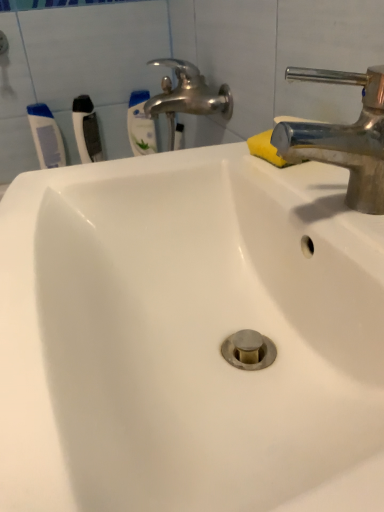
You are a GUI agent. You are given a task and a screenshot of the screen. Output one action in this format:
    pyautogui.click(x=<x>, y=<y>)
    Task: Click on the white plastic toothbrush at upper left, the second toothbrush from the left
    The height and width of the screenshot is (512, 384).
    Given the screenshot: What is the action you would take?
    (x=86, y=130)

Locate an element on the screen. polished chrome tap at upper right is located at coordinates (343, 137).

What are the coordinates of `white plastic toothbrush at upper left, acting as the second toothbrush starting from the right` in the screenshot? It's located at (86, 130).

Can you confirm if white plastic toothbrush at upper left, acting as the second toothbrush starting from the right, is positioned to the right of yellow sponge at upper right?

No, white plastic toothbrush at upper left, acting as the second toothbrush starting from the right, is not to the right of yellow sponge at upper right.

Image resolution: width=384 pixels, height=512 pixels. Find the location of `toothbrush that is the 2nd object located above the yellow sponge at upper right (from the image's perspective)`. toothbrush that is the 2nd object located above the yellow sponge at upper right (from the image's perspective) is located at coordinates (86, 130).

From the image's perspective, which one is positioned lower, white plastic toothbrush at upper left, acting as the second toothbrush starting from the right, or yellow sponge at upper right?

yellow sponge at upper right appears lower in the image.

Do you think yellow sponge at upper right is within white plastic toothbrush at upper left, the second toothbrush from the left, or outside of it?

yellow sponge at upper right is not enclosed by white plastic toothbrush at upper left, the second toothbrush from the left.

Is yellow sponge at upper right oriented towards white plastic toothbrush at upper left, acting as the second toothbrush starting from the right?

No, yellow sponge at upper right does not turn towards white plastic toothbrush at upper left, acting as the second toothbrush starting from the right.

Is there a large distance between yellow sponge at upper right and white plastic toothbrush at upper left, acting as the second toothbrush starting from the right?

No, yellow sponge at upper right is in close proximity to white plastic toothbrush at upper left, acting as the second toothbrush starting from the right.

Considering the relative sizes of yellow sponge at upper right and white plastic toothbrush at upper left, acting as the second toothbrush starting from the right, in the image provided, is yellow sponge at upper right taller than white plastic toothbrush at upper left, acting as the second toothbrush starting from the right,?

In fact, yellow sponge at upper right may be shorter than white plastic toothbrush at upper left, acting as the second toothbrush starting from the right.

From the image's perspective, is white plastic toothbrush at upper left, which is the third toothbrush from left to right, below polished chrome tap at upper right?

Incorrect, from the image's perspective, white plastic toothbrush at upper left, which is the third toothbrush from left to right, is higher than polished chrome tap at upper right.

Is white plastic toothbrush at upper left, which is the third toothbrush from left to right, turned away from polished chrome tap at upper right?

That's not correct — white plastic toothbrush at upper left, which is the third toothbrush from left to right, is not looking away from polished chrome tap at upper right.

Does white plastic toothbrush at upper left, which is the third toothbrush from left to right, have a lesser width compared to polished chrome tap at upper right?

Correct, the width of white plastic toothbrush at upper left, which is the third toothbrush from left to right, is less than that of polished chrome tap at upper right.

Does white plastic toothbrush at upper left, which ranks as the 1th toothbrush in right-to-left order, appear on the left side of polished chrome tap at upper right?

Yes, white plastic toothbrush at upper left, which ranks as the 1th toothbrush in right-to-left order, is to the left of polished chrome tap at upper right.

Does point (58, 146) appear closer or farther from the camera than point (284, 148)?

Point (58, 146).

This screenshot has height=512, width=384. I want to click on tap located below the white plastic toothbrush at upper left, acting as the first toothbrush starting from the left (from the image's perspective), so click(343, 137).

Is white plastic toothbrush at upper left, which is the third toothbrush in right-to-left order, taller or shorter than polished chrome tap at upper right?

In the image, white plastic toothbrush at upper left, which is the third toothbrush in right-to-left order, appears to be taller than polished chrome tap at upper right.

From the image's perspective, which one is positioned higher, yellow sponge at upper right or white plastic toothbrush at upper left, which ranks as the 1th toothbrush in right-to-left order?

From the image's view, white plastic toothbrush at upper left, which ranks as the 1th toothbrush in right-to-left order, is above.

Considering the relative sizes of yellow sponge at upper right and white plastic toothbrush at upper left, which is the third toothbrush from left to right, in the image provided, is yellow sponge at upper right smaller than white plastic toothbrush at upper left, which is the third toothbrush from left to right,?

Indeed, yellow sponge at upper right has a smaller size compared to white plastic toothbrush at upper left, which is the third toothbrush from left to right.

Is yellow sponge at upper right positioned beyond the bounds of white plastic toothbrush at upper left, which is the third toothbrush from left to right?

Indeed, yellow sponge at upper right is completely outside white plastic toothbrush at upper left, which is the third toothbrush from left to right.

From a real-world perspective, does polished chrome tap at upper right stand above white plastic toothbrush at upper left, which ranks as the 1th toothbrush in right-to-left order?

Yes, from a real-world perspective, polished chrome tap at upper right is over white plastic toothbrush at upper left, which ranks as the 1th toothbrush in right-to-left order

Based on their positions, is polished chrome tap at upper right located to the left or right of white plastic toothbrush at upper left, which is the third toothbrush from left to right?

Clearly, polished chrome tap at upper right is on the right of white plastic toothbrush at upper left, which is the third toothbrush from left to right, in the image.

The width and height of the screenshot is (384, 512). In the image, there is a white plastic toothbrush at upper left, which ranks as the 1th toothbrush in right-to-left order. Identify the location of tap below it (from the image's perspective). (343, 137).

Would you say white plastic toothbrush at upper left, which is the third toothbrush in right-to-left order, is inside or outside white plastic toothbrush at upper left, acting as the second toothbrush starting from the right?

white plastic toothbrush at upper left, which is the third toothbrush in right-to-left order, is not inside white plastic toothbrush at upper left, acting as the second toothbrush starting from the right, it's outside.

Is white plastic toothbrush at upper left, acting as the first toothbrush starting from the left, facing away from white plastic toothbrush at upper left, the second toothbrush from the left?

No, white plastic toothbrush at upper left, acting as the first toothbrush starting from the left, is not facing away from white plastic toothbrush at upper left, the second toothbrush from the left.

Could you measure the distance between white plastic toothbrush at upper left, acting as the first toothbrush starting from the left, and white plastic toothbrush at upper left, acting as the second toothbrush starting from the right?

white plastic toothbrush at upper left, acting as the first toothbrush starting from the left, and white plastic toothbrush at upper left, acting as the second toothbrush starting from the right, are 3.73 inches apart from each other.

Is white plastic toothbrush at upper left, which is the third toothbrush in right-to-left order, taller or shorter than white plastic toothbrush at upper left, the second toothbrush from the left?

white plastic toothbrush at upper left, which is the third toothbrush in right-to-left order, is shorter than white plastic toothbrush at upper left, the second toothbrush from the left.

At what (x,y) coordinates should I click in order to perform the action: click on soap lying below the white plastic toothbrush at upper left, the second toothbrush from the left (from the image's perspective). Please return your answer as a coordinate pair (x, y). The image size is (384, 512). Looking at the image, I should click on (265, 149).

Find the location of a particular element. This screenshot has height=512, width=384. soap on the right of white plastic toothbrush at upper left, acting as the second toothbrush starting from the right is located at coordinates (265, 149).

From the image, which object appears to be farther from polished chrome tap at upper right, white plastic toothbrush at upper left, which is the third toothbrush from left to right, or yellow sponge at upper right?

white plastic toothbrush at upper left, which is the third toothbrush from left to right, lies further to polished chrome tap at upper right than the other object.

Considering their positions, is white plastic toothbrush at upper left, acting as the first toothbrush starting from the left, positioned further to white plastic toothbrush at upper left, which is the third toothbrush from left to right, than white plastic toothbrush at upper left, acting as the second toothbrush starting from the right?

The object further to white plastic toothbrush at upper left, which is the third toothbrush from left to right, is white plastic toothbrush at upper left, acting as the first toothbrush starting from the left.

Based on their spatial positions, is white plastic toothbrush at upper left, which is the third toothbrush from left to right, or white plastic toothbrush at upper left, acting as the second toothbrush starting from the right, further from white plastic toothbrush at upper left, which is the third toothbrush in right-to-left order?

white plastic toothbrush at upper left, which is the third toothbrush from left to right, lies further to white plastic toothbrush at upper left, which is the third toothbrush in right-to-left order, than the other object.

Looking at the image, which one is located further to white plastic toothbrush at upper left, which is the third toothbrush from left to right, white plastic toothbrush at upper left, the second toothbrush from the left, or polished chrome tap at upper right?

polished chrome tap at upper right is further to white plastic toothbrush at upper left, which is the third toothbrush from left to right.

Based on their spatial positions, is white plastic toothbrush at upper left, acting as the second toothbrush starting from the right, or white plastic toothbrush at upper left, acting as the first toothbrush starting from the left, closer to white plastic toothbrush at upper left, which is the third toothbrush from left to right?

white plastic toothbrush at upper left, acting as the second toothbrush starting from the right.

Based on their spatial positions, is yellow sponge at upper right or white plastic toothbrush at upper left, which is the third toothbrush from left to right, further from white plastic toothbrush at upper left, acting as the second toothbrush starting from the right?

Among the two, yellow sponge at upper right is located further to white plastic toothbrush at upper left, acting as the second toothbrush starting from the right.

Which object lies further to the anchor point yellow sponge at upper right, white plastic toothbrush at upper left, which ranks as the 1th toothbrush in right-to-left order, or white plastic toothbrush at upper left, the second toothbrush from the left?

white plastic toothbrush at upper left, which ranks as the 1th toothbrush in right-to-left order.

Consider the image. When comparing their distances from yellow sponge at upper right, does polished chrome tap at upper right or white plastic toothbrush at upper left, the second toothbrush from the left, seem closer?

Among the two, polished chrome tap at upper right is located nearer to yellow sponge at upper right.

Find the location of a particular element. Image resolution: width=384 pixels, height=512 pixels. soap between polished chrome tap at upper right and white plastic toothbrush at upper left, the second toothbrush from the left, from front to back is located at coordinates (265, 149).

Locate an element on the screen. This screenshot has width=384, height=512. toothbrush between white plastic toothbrush at upper left, acting as the first toothbrush starting from the left, and white plastic toothbrush at upper left, which ranks as the 1th toothbrush in right-to-left order is located at coordinates (86, 130).

Where is `toothbrush positioned between yellow sponge at upper right and white plastic toothbrush at upper left, which is the third toothbrush in right-to-left order, from near to far`? toothbrush positioned between yellow sponge at upper right and white plastic toothbrush at upper left, which is the third toothbrush in right-to-left order, from near to far is located at coordinates (86, 130).

At what (x,y) coordinates should I click in order to perform the action: click on toothbrush located between polished chrome tap at upper right and white plastic toothbrush at upper left, which is the third toothbrush in right-to-left order, in the depth direction. Please return your answer as a coordinate pair (x, y). This screenshot has width=384, height=512. Looking at the image, I should click on (86, 130).